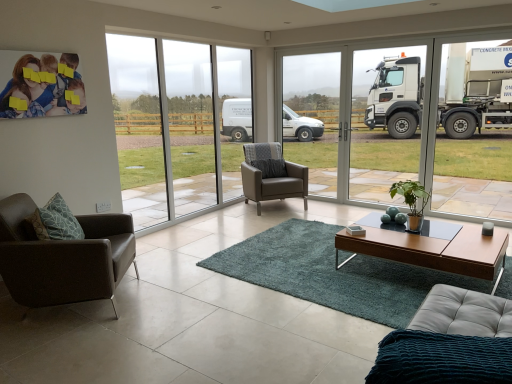
Question: Looking at their shapes, would you say wooden glossy coffee table at center is wider or thinner than leather armchair at center, which ranks as the second chair in left-to-right order?

Choices:
 (A) thin
 (B) wide

Answer: (A)

Question: From the image's perspective, relative to leather armchair at center, the 1th chair positioned from the back, is wooden glossy coffee table at center above or below?

Choices:
 (A) below
 (B) above

Answer: (A)

Question: Estimate the real-world distances between objects in this image. Which object is farther from the brown leather chair at lower left, which is the second chair from back to front?

Choices:
 (A) leather armchair at center, positioned as the 2th chair in front-to-back order
 (B) clear glass door at center, the 2th window frame in the right-to-left sequence
 (C) teal shaggy rug at center
 (D) transparent glass window at center
 (E) translucent glass table at center

Answer: (B)

Question: Considering the real-world distances, which object is farthest from the wooden glossy coffee table at center?

Choices:
 (A) teal shaggy rug at center
 (B) brown leather chair at lower left, the second chair in the right-to-left sequence
 (C) transparent glass window at center, the first window frame in the right-to-left sequence
 (D) transparent glass window at center
 (E) clear glass door at center, arranged as the 1th window frame when viewed from the left

Answer: (E)